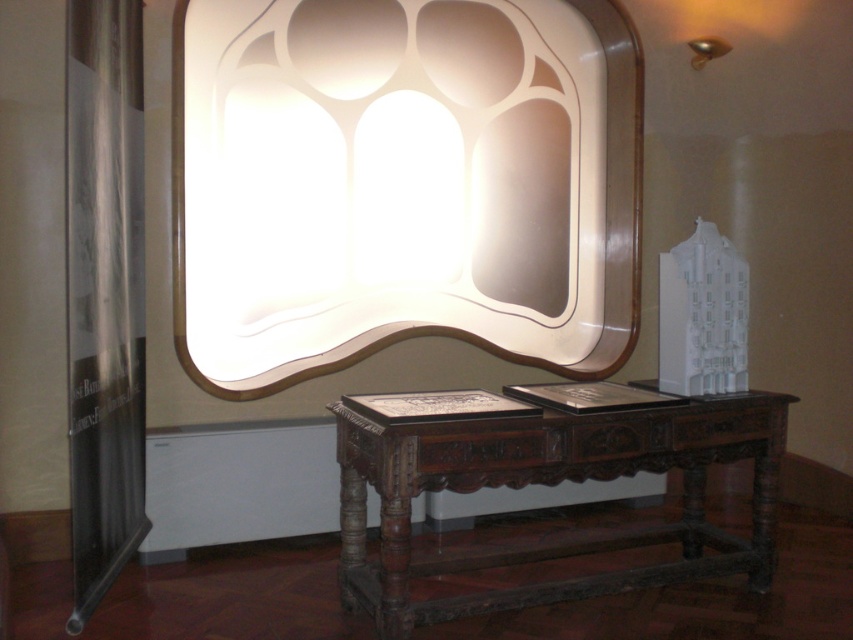
Question: Where is dark brown wood table at center located in relation to metallic gold lamp at upper right in the image?

Choices:
 (A) above
 (B) below

Answer: (B)

Question: Which of the following is the farthest from the observer?

Choices:
 (A) (703, 61)
 (B) (721, 403)

Answer: (A)

Question: Estimate the real-world distances between objects in this image. Which object is farther from the white glossy mirror at upper center?

Choices:
 (A) metallic gold lamp at upper right
 (B) dark brown wood table at center

Answer: (B)

Question: In this image, where is white glossy mirror at upper center located relative to metallic gold lamp at upper right?

Choices:
 (A) left
 (B) right

Answer: (A)

Question: Is white glossy mirror at upper center to the left of metallic gold lamp at upper right from the viewer's perspective?

Choices:
 (A) no
 (B) yes

Answer: (B)

Question: Which of the following is the closest to the observer?

Choices:
 (A) (341, 497)
 (B) (235, 250)

Answer: (A)